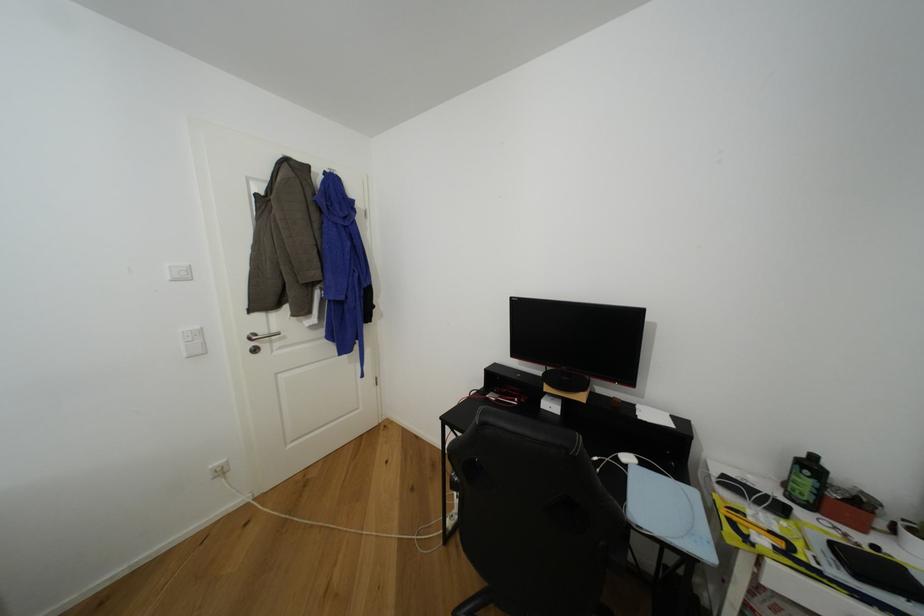
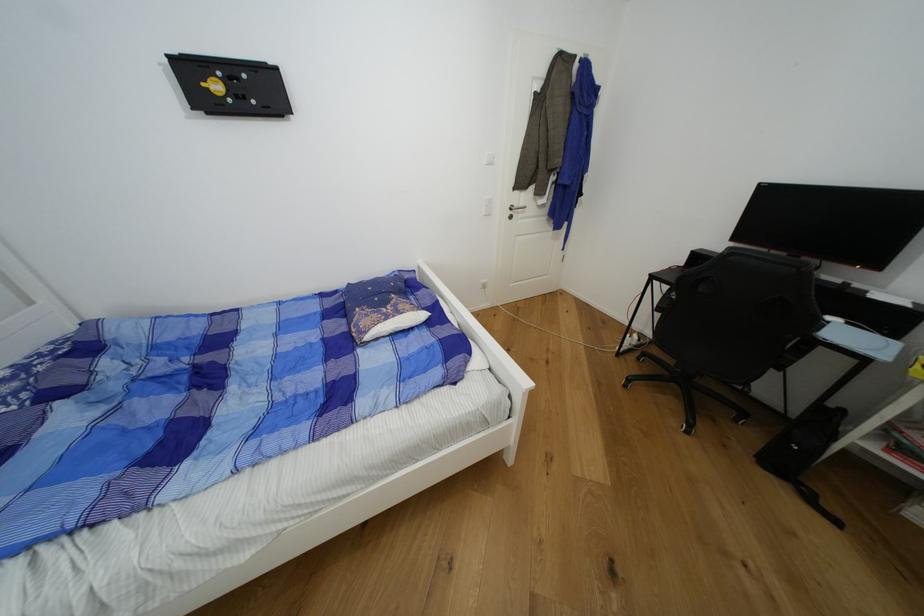
In the second image, find the point that corresponds to (x=268, y=334) in the first image.

(521, 207)